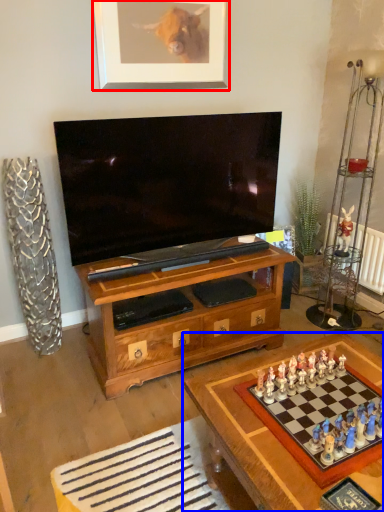
Question: Which point is closer to the camera, picture frame (highlighted by a red box) or table (highlighted by a blue box)?

Choices:
 (A) picture frame
 (B) table

Answer: (B)